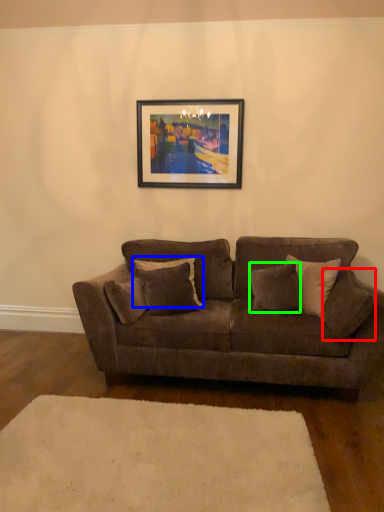
Question: Estimate the real-world distances between objects in this image. Which object is closer to pillow (highlighted by a red box), pillow (highlighted by a blue box) or pillow (highlighted by a green box)?

Choices:
 (A) pillow
 (B) pillow

Answer: (B)